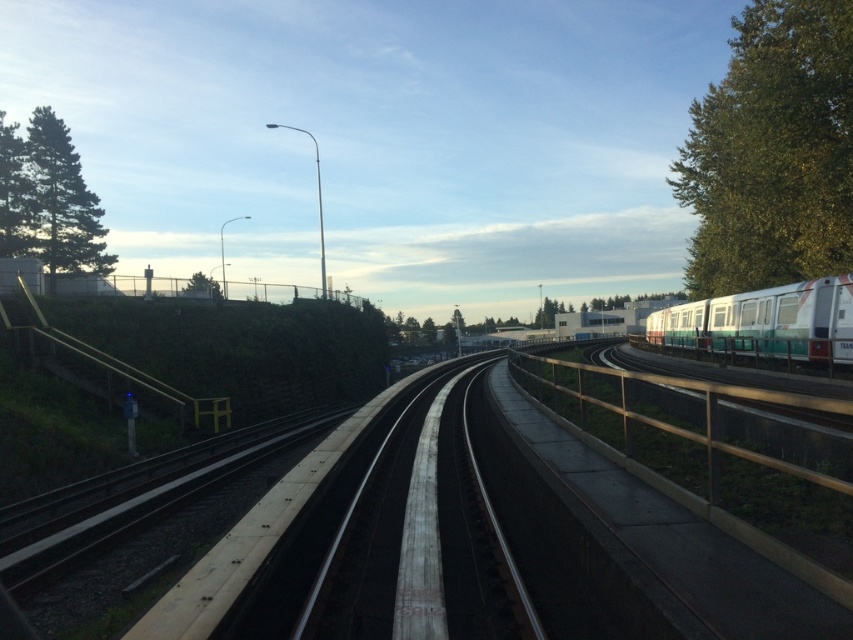
Who is higher up, white glossy passenger train at right or green leafy tree at left?

Positioned higher is green leafy tree at left.

Between point (814, 340) and point (7, 188), which one is positioned behind?

The point (7, 188) is more distant.

Where is `white glossy passenger train at right`? white glossy passenger train at right is located at coordinates (764, 321).

At what (x,y) coordinates should I click in order to perform the action: click on white glossy passenger train at right. Please return your answer as a coordinate pair (x, y). Looking at the image, I should click on (764, 321).

Which is above, green matte tree at upper left or white glossy passenger train at right?

Positioned higher is green matte tree at upper left.

Does green matte tree at upper left appear on the right side of white glossy passenger train at right?

In fact, green matte tree at upper left is to the left of white glossy passenger train at right.

Is point (51, 221) in front of point (820, 291)?

No, it is not.

The image size is (853, 640). Identify the location of green matte tree at upper left. (48, 198).

Who is lower down, green leafy tree at upper right or green matte tree at upper left?

green matte tree at upper left is below.

The height and width of the screenshot is (640, 853). I want to click on green leafy tree at upper right, so click(x=772, y=152).

Which is behind, point (683, 188) or point (38, 161)?

The point (38, 161) is more distant.

Find the location of a particular element. The width and height of the screenshot is (853, 640). green leafy tree at upper right is located at coordinates (772, 152).